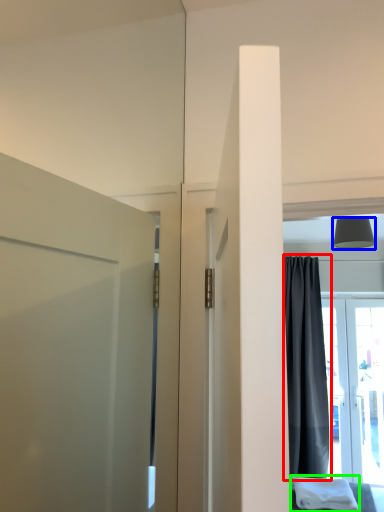
Question: Considering the real-world distances, which object is farthest from curtain (highlighted by a red box)? lamp (highlighted by a blue box) or cloth (highlighted by a green box)?

Choices:
 (A) lamp
 (B) cloth

Answer: (A)